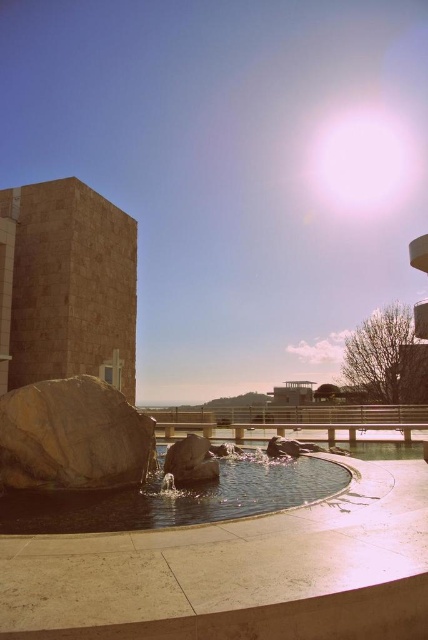
Does clear glass water at center have a greater height compared to rustic stone boulder at lower left?

No.

What do you see at coordinates (177, 499) in the screenshot? I see `clear glass water at center` at bounding box center [177, 499].

Find the location of a particular element. Image resolution: width=428 pixels, height=640 pixels. clear glass water at center is located at coordinates (177, 499).

Between clear glass water at center and smooth gray rock at center, which one appears on the left side from the viewer's perspective?

smooth gray rock at center

Describe the element at coordinates (177, 499) in the screenshot. I see `clear glass water at center` at that location.

Where is `clear glass water at center`? This screenshot has width=428, height=640. clear glass water at center is located at coordinates (177, 499).

Does rustic stone boulder at lower left have a smaller size compared to smooth gray rock at center?

Actually, rustic stone boulder at lower left might be larger than smooth gray rock at center.

Does rustic stone boulder at lower left appear under smooth gray rock at center?

Incorrect, rustic stone boulder at lower left is not positioned below smooth gray rock at center.

Describe the element at coordinates (71, 436) in the screenshot. I see `rustic stone boulder at lower left` at that location.

Identify the location of rustic stone boulder at lower left. (71, 436).